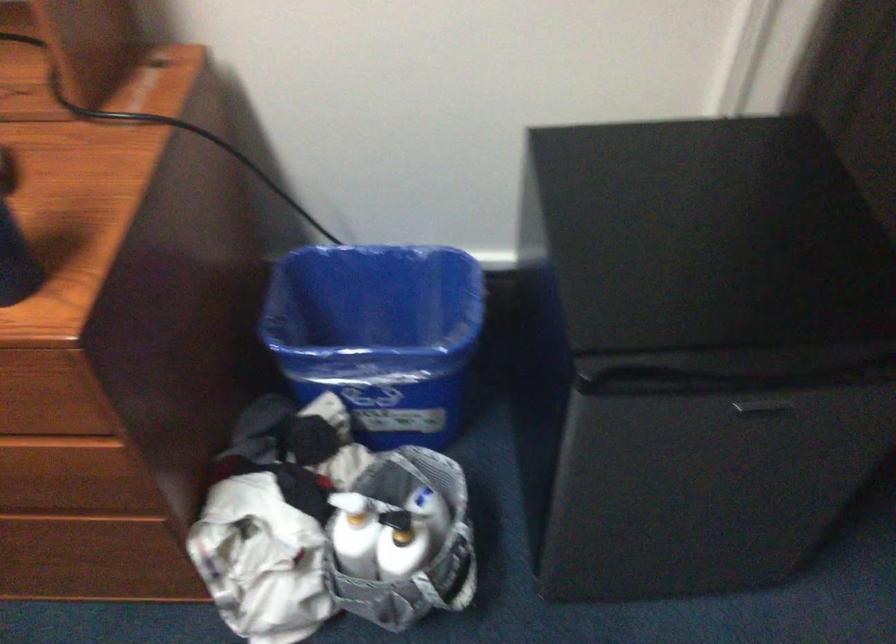
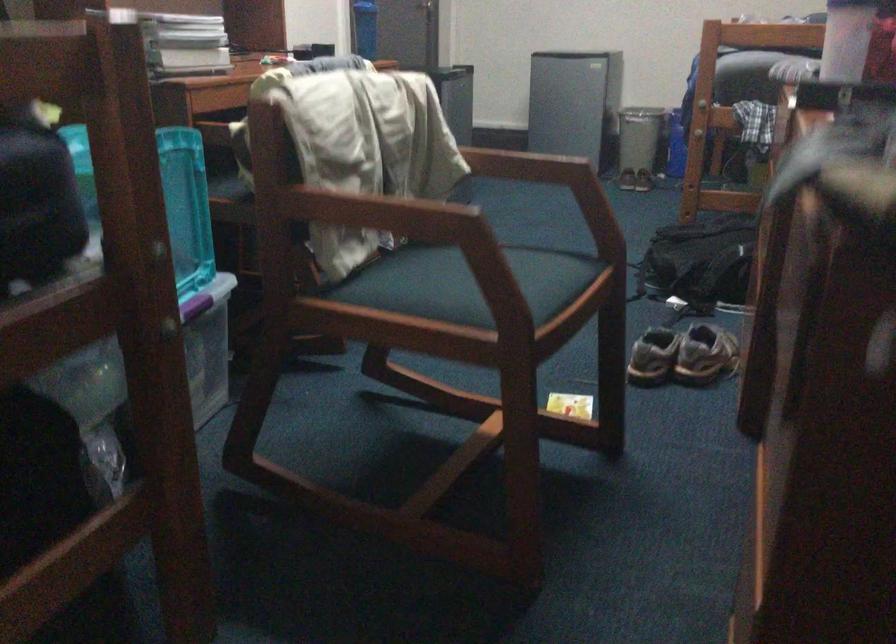
Question: I am providing you with two images of the same scene from different viewpoints. After the viewpoint changes to image2, which objects are now occluded?

Choices:
 (A) pair of sneakers
 (B) brown envelope
 (C) chair sitting surface
 (D) white bottle pump

Answer: (D)